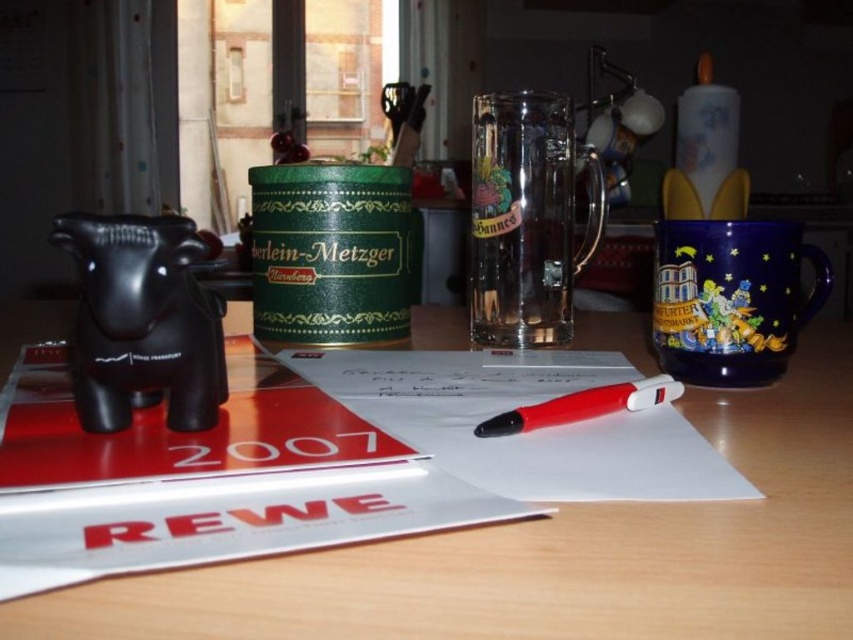
You are standing at the edge of the wooden table at center and want to reach the black rubber elephant at left. Which direction should you move to get closer to the elephant?

Since the wooden table at center is closer to the viewer than the black rubber elephant at left, you should move towards the left direction to get closer to the black rubber elephant at left.

You are a photographer standing at the camera position. You want to capture a closeup shot of the point at coordinates point (97, 392). Can you focus on this point without moving the camera? The maximum focusing distance of your camera is 30 centimeters.

The distance of point (97, 392) from camera is 34.06 centimeters, which exceeds the camera maximum focusing distance of 30 centimeters. Therefore, the photographer cannot focus on this point without moving the camera.